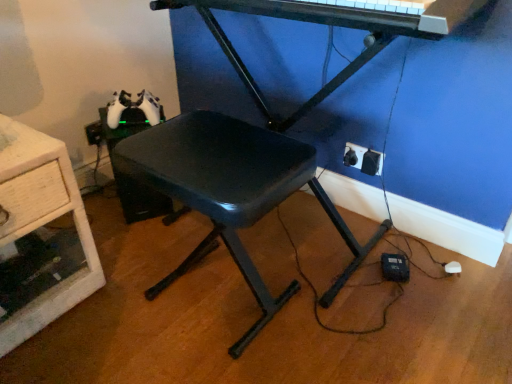
This screenshot has width=512, height=384. Find the location of `vacant space underneath black plastic stool at center (from a real-world perspective)`. vacant space underneath black plastic stool at center (from a real-world perspective) is located at coordinates (214, 301).